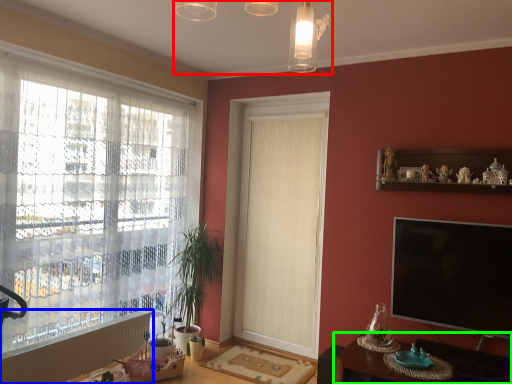
Question: Which object is positioned closest to light fixture (highlighted by a red box)? Select from radiator (highlighted by a blue box) and table (highlighted by a green box).

Choices:
 (A) radiator
 (B) table

Answer: (B)